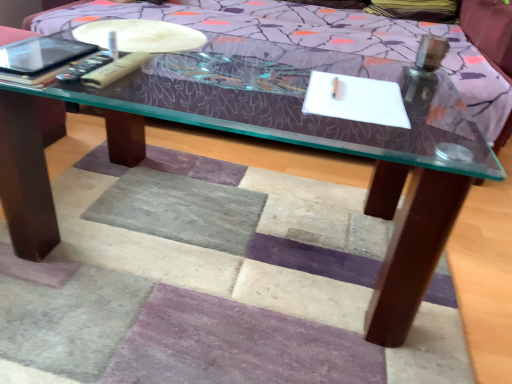
Question: Does point (131, 44) appear closer or farther from the camera than point (69, 41)?

Choices:
 (A) closer
 (B) farther

Answer: (B)

Question: Is matte plastic remote control at upper left situated inside matte black tablet at upper left or outside?

Choices:
 (A) inside
 (B) outside

Answer: (B)

Question: Estimate the real-world distances between objects in this image. Which object is closer to the matte black tablet at upper left?

Choices:
 (A) matte plastic remote control at upper left
 (B) beige plastic remote at upper left, the first remote from the right
 (C) black plastic remote at left, placed as the second remote when sorted from right to left

Answer: (C)

Question: Estimate the real-world distances between objects in this image. Which object is farther from the matte plastic remote control at upper left?

Choices:
 (A) beige plastic remote at upper left, which appears as the second remote when viewed from the left
 (B) matte black tablet at upper left
 (C) black plastic remote at left, placed as the second remote when sorted from right to left

Answer: (C)